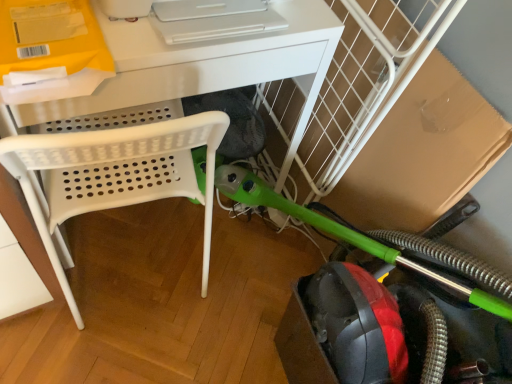
Measure the distance between white plastic desk at upper center and camera.

white plastic desk at upper center is 24.80 inches from camera.

Describe the element at coordinates (209, 67) in the screenshot. The height and width of the screenshot is (384, 512). I see `white plastic desk at upper center` at that location.

Where is `white plastic desk at upper center`? white plastic desk at upper center is located at coordinates (209, 67).

Where is `green rubber garden hose at lower right`? The image size is (512, 384). green rubber garden hose at lower right is located at coordinates (343, 233).

In order to face green rubber garden hose at lower right, should I rotate leftwards or rightwards?

You should rotate right by 16.464 degrees.

Describe the element at coordinates (343, 233) in the screenshot. I see `green rubber garden hose at lower right` at that location.

You are a GUI agent. You are given a task and a screenshot of the screen. Output one action in this format:
    pyautogui.click(x=<x>, y=<y>)
    Task: Click on the white plastic desk at upper center
    
    Given the screenshot: What is the action you would take?
    pyautogui.click(x=209, y=67)

Would you say white plastic desk at upper center is to the left or to the right of green rubber garden hose at lower right in the picture?

Clearly, white plastic desk at upper center is on the left of green rubber garden hose at lower right in the image.

Looking at this image, relative to green rubber garden hose at lower right, is white plastic desk at upper center in front or behind?

Visually, white plastic desk at upper center is located behind green rubber garden hose at lower right.

Considering the points (146, 133) and (406, 259), which point is in front, point (146, 133) or point (406, 259)?

Positioned in front is point (146, 133).

From the image's perspective, does white plastic desk at upper center appear higher than green rubber garden hose at lower right?

Yes, from the image's perspective, white plastic desk at upper center is above green rubber garden hose at lower right.

From a real-world perspective, who is located lower, white plastic desk at upper center or green rubber garden hose at lower right?

From a 3D spatial view, green rubber garden hose at lower right is below.

Does white plastic desk at upper center have a lesser width compared to green rubber garden hose at lower right?

No.

Between white plastic desk at upper center and green rubber garden hose at lower right, which one has more height?

white plastic desk at upper center.

Between white plastic desk at upper center and green rubber garden hose at lower right, which one has smaller size?

Smaller between the two is green rubber garden hose at lower right.

Is white plastic desk at upper center situated inside green rubber garden hose at lower right or outside?

white plastic desk at upper center is outside green rubber garden hose at lower right.

Are white plastic desk at upper center and green rubber garden hose at lower right far apart?

No, white plastic desk at upper center is not far away from green rubber garden hose at lower right.

Is white plastic desk at upper center aimed at green rubber garden hose at lower right?

Yes, white plastic desk at upper center faces towards green rubber garden hose at lower right.

Locate an element on the screen. The height and width of the screenshot is (384, 512). desk that is above the green rubber garden hose at lower right (from the image's perspective) is located at coordinates (209, 67).

Visually, is green rubber garden hose at lower right positioned to the left or to the right of white plastic desk at upper center?

green rubber garden hose at lower right is to the right of white plastic desk at upper center.

Which is behind, green rubber garden hose at lower right or white plastic desk at upper center?

white plastic desk at upper center is more distant.

Considering the points (472, 296) and (117, 159), which point is in front, point (472, 296) or point (117, 159)?

The point (117, 159) is in front.

From the image's perspective, is green rubber garden hose at lower right under white plastic desk at upper center?

Correct, green rubber garden hose at lower right appears lower than white plastic desk at upper center in the image.

From a real-world perspective, is green rubber garden hose at lower right above or below white plastic desk at upper center?

green rubber garden hose at lower right is below white plastic desk at upper center.

Which of these two, green rubber garden hose at lower right or white plastic desk at upper center, is thinner?

Thinner between the two is green rubber garden hose at lower right.

From their relative heights in the image, would you say green rubber garden hose at lower right is taller or shorter than white plastic desk at upper center?

green rubber garden hose at lower right is shorter than white plastic desk at upper center.

Considering the sizes of objects green rubber garden hose at lower right and white plastic desk at upper center in the image provided, who is smaller, green rubber garden hose at lower right or white plastic desk at upper center?

With smaller size is green rubber garden hose at lower right.

Which is correct: green rubber garden hose at lower right is inside white plastic desk at upper center, or outside of it?

green rubber garden hose at lower right is not inside white plastic desk at upper center, it's outside.

Is green rubber garden hose at lower right placed right next to white plastic desk at upper center?

No.

Is green rubber garden hose at lower right positioned with its back to white plastic desk at upper center?

No.

Can you tell me how much green rubber garden hose at lower right and white plastic desk at upper center differ in facing direction?

There is a 91.7-degree angle between the facing directions of green rubber garden hose at lower right and white plastic desk at upper center.

Identify the location of desk on the left of the green rubber garden hose at lower right. (209, 67).

In order to click on garden hose below the white plastic desk at upper center (from a real-world perspective) in this screenshot , I will do `click(343, 233)`.

In the image, there is a white plastic desk at upper center. Where is `garden hose below it (from the image's perspective)`? The width and height of the screenshot is (512, 384). garden hose below it (from the image's perspective) is located at coordinates (343, 233).